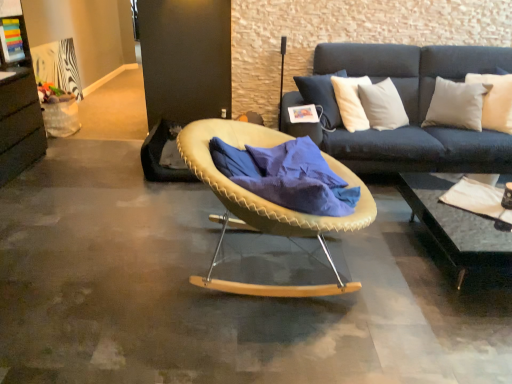
Question: Is black glass coffee table at lower right shorter than beige woven chair at center?

Choices:
 (A) no
 (B) yes

Answer: (B)

Question: From the image's perspective, is black glass coffee table at lower right above beige woven chair at center?

Choices:
 (A) no
 (B) yes

Answer: (A)

Question: Does black glass coffee table at lower right touch beige woven chair at center?

Choices:
 (A) yes
 (B) no

Answer: (B)

Question: Does black glass coffee table at lower right have a greater width compared to beige woven chair at center?

Choices:
 (A) no
 (B) yes

Answer: (B)

Question: Considering the relative sizes of black glass coffee table at lower right and beige woven chair at center in the image provided, is black glass coffee table at lower right thinner than beige woven chair at center?

Choices:
 (A) no
 (B) yes

Answer: (A)

Question: Is blue soft fabric at center taller or shorter than white soft cushion at upper right?

Choices:
 (A) tall
 (B) short

Answer: (B)

Question: Is blue soft fabric at center to the left or to the right of white soft cushion at upper right in the image?

Choices:
 (A) left
 (B) right

Answer: (A)

Question: From a real-world perspective, is blue soft fabric at center physically located above or below white soft cushion at upper right?

Choices:
 (A) above
 (B) below

Answer: (B)

Question: Considering the positions of blue soft fabric at center and white soft cushion at upper right in the image, is blue soft fabric at center bigger or smaller than white soft cushion at upper right?

Choices:
 (A) small
 (B) big

Answer: (B)

Question: Considering the positions of beige woven chair at center and black glass coffee table at lower right in the image, is beige woven chair at center bigger or smaller than black glass coffee table at lower right?

Choices:
 (A) big
 (B) small

Answer: (B)

Question: From the image's perspective, is beige woven chair at center above or below black glass coffee table at lower right?

Choices:
 (A) above
 (B) below

Answer: (A)

Question: Based on their positions, is beige woven chair at center located to the left or right of black glass coffee table at lower right?

Choices:
 (A) left
 (B) right

Answer: (A)

Question: Looking at their shapes, would you say beige woven chair at center is wider or thinner than black glass coffee table at lower right?

Choices:
 (A) thin
 (B) wide

Answer: (A)

Question: Considering the positions of black glass coffee table at lower right and white soft cushion at upper right in the image, is black glass coffee table at lower right taller or shorter than white soft cushion at upper right?

Choices:
 (A) short
 (B) tall

Answer: (A)

Question: Considering the positions of point (444, 223) and point (498, 94), is point (444, 223) closer or farther from the camera than point (498, 94)?

Choices:
 (A) farther
 (B) closer

Answer: (B)